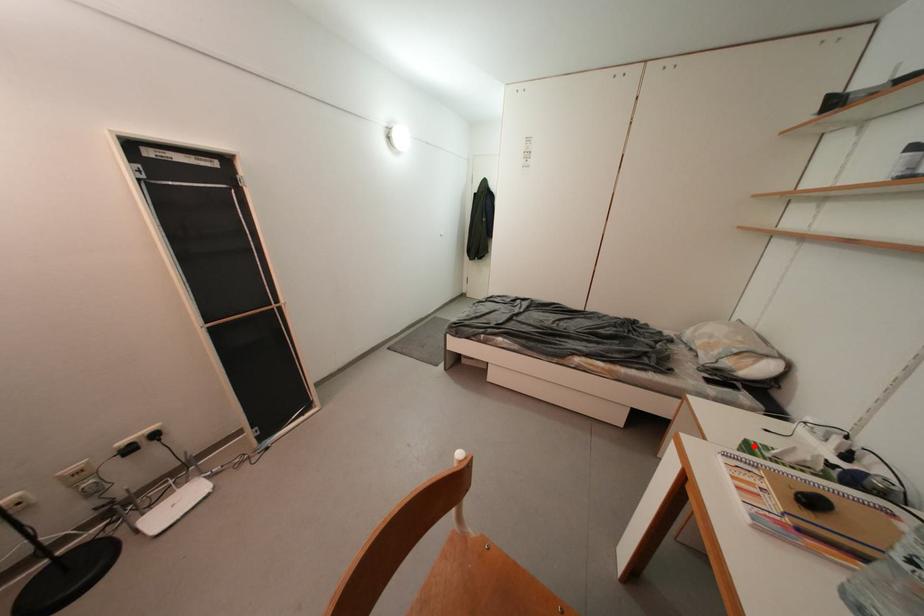
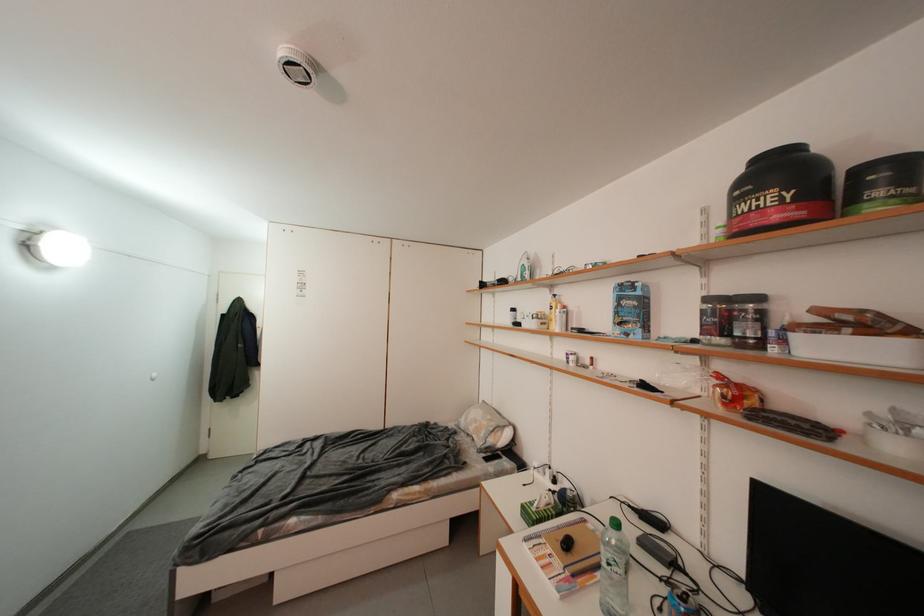
The point at the highlighted location is marked in the first image. Where is the corresponding point in the second image?

(530, 509)